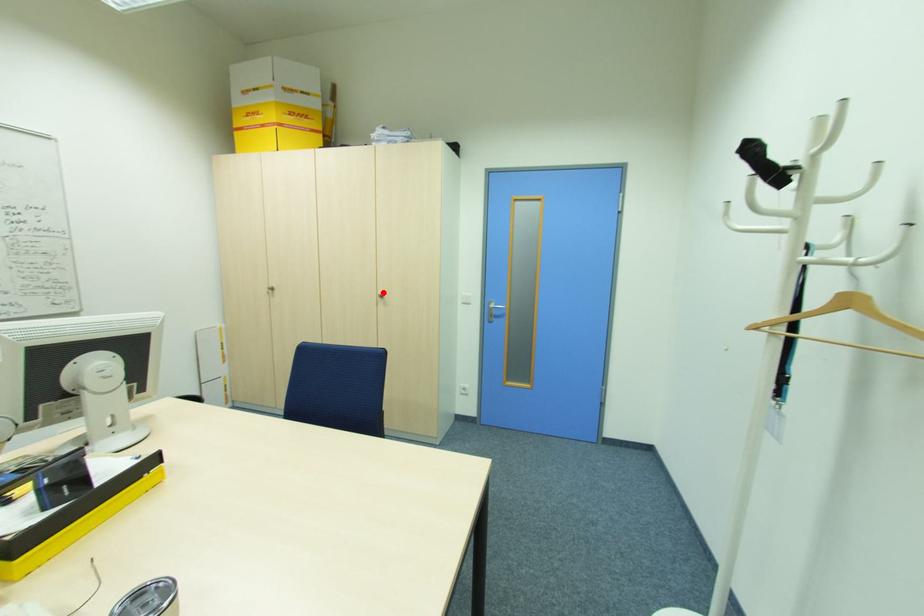
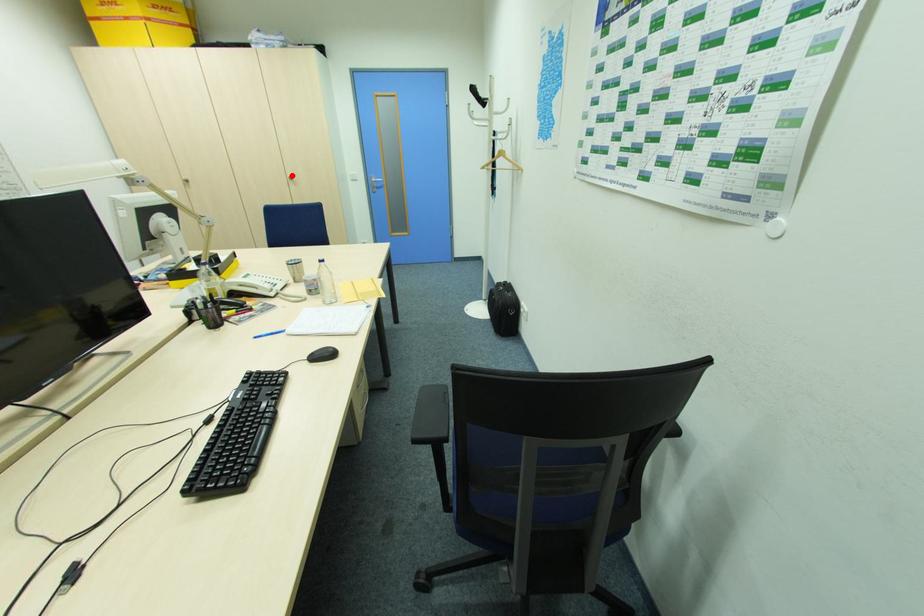
I am providing you with two images of the same scene from different viewpoints. A red point is marked on the first image and another point is marked on the second image. Are the points marked in image1 and image2 representing the same 3D position?

Yes